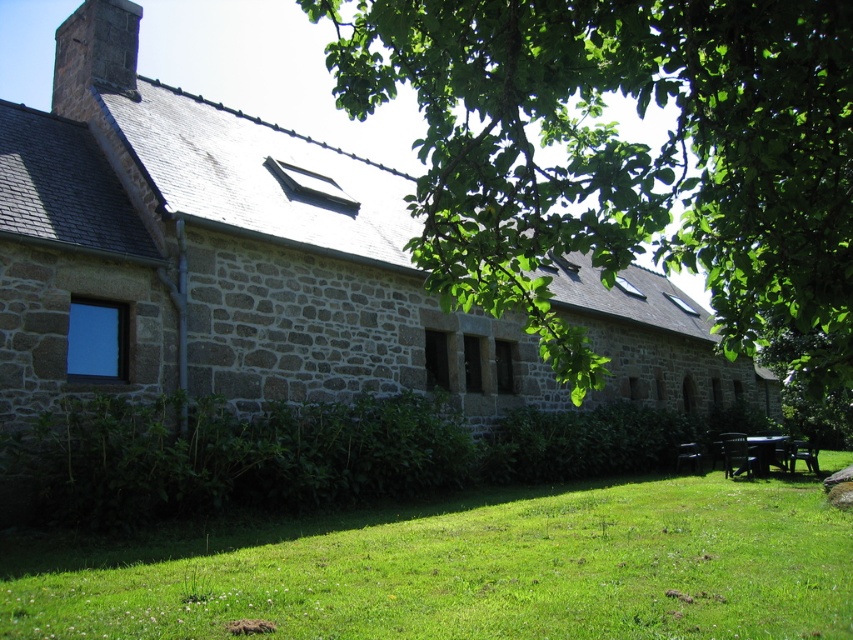
Question: Which object appears farthest from the camera in this image?

Choices:
 (A) green grass at lower center
 (B) green leafy tree at upper center
 (C) black plastic picnic table at lower right

Answer: (C)

Question: Can you confirm if green leafy tree at upper center is positioned to the right of green grass at lower center?

Choices:
 (A) no
 (B) yes

Answer: (B)

Question: In this image, where is green leafy tree at upper center located relative to black plastic picnic table at lower right?

Choices:
 (A) below
 (B) above

Answer: (B)

Question: Which object is farther from the camera taking this photo?

Choices:
 (A) black plastic picnic table at lower right
 (B) green leafy tree at upper center
 (C) green grass at lower center

Answer: (A)

Question: Which object is the farthest from the black plastic picnic table at lower right?

Choices:
 (A) green grass at lower center
 (B) green leafy tree at upper center

Answer: (B)

Question: In this image, where is green grass at lower center located relative to black plastic picnic table at lower right?

Choices:
 (A) above
 (B) below

Answer: (A)